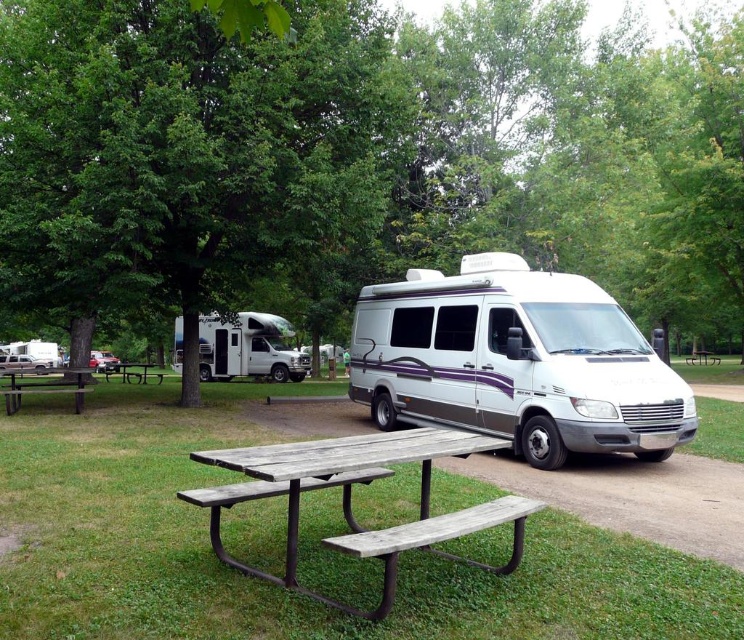
Question: Estimate the real-world distances between objects in this image. Which object is farther from the wooden picnic table at lower left?

Choices:
 (A) white glossy van at center
 (B) weathered wood picnic table at center

Answer: (B)

Question: Does weathered wood picnic table at center appear on the left side of weathered wood bench at lower center?

Choices:
 (A) yes
 (B) no

Answer: (A)

Question: Which of the following is the farthest from the observer?

Choices:
 (A) (173, 342)
 (B) (12, 388)
 (C) (408, 525)

Answer: (A)

Question: Where is weathered wood picnic table at center located in relation to weathered wood bench at lower center in the image?

Choices:
 (A) left
 (B) right

Answer: (A)

Question: Among these points, which one is nearest to the camera?

Choices:
 (A) (243, 492)
 (B) (251, 374)
 (C) (86, 387)
 (D) (141, 298)

Answer: (A)

Question: Does weathered wood bench at lower center have a smaller size compared to wooden bench at center?

Choices:
 (A) yes
 (B) no

Answer: (A)